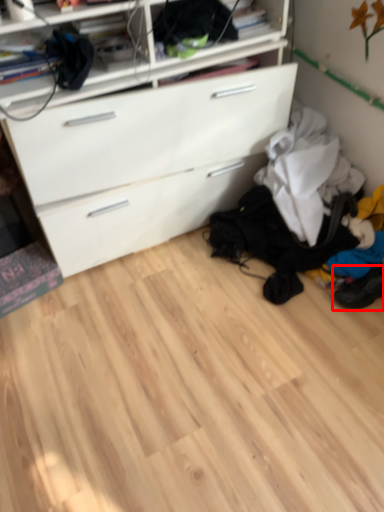
Question: From the image's perspective, considering the relative positions of footwear (annotated by the red box) and shelf in the image provided, where is footwear (annotated by the red box) located with respect to the staircase?

Choices:
 (A) above
 (B) below

Answer: (B)